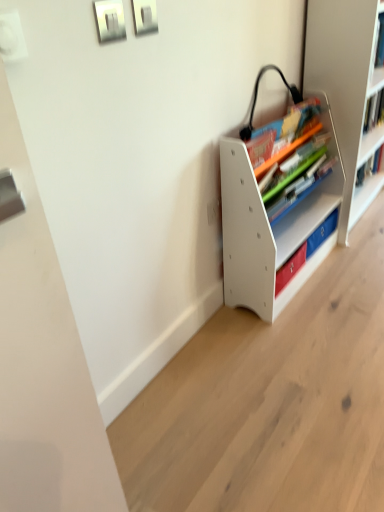
This screenshot has height=512, width=384. I want to click on vacant region to the right of white matte bookshelf at center, which is the first shelf from left to right, so click(x=350, y=267).